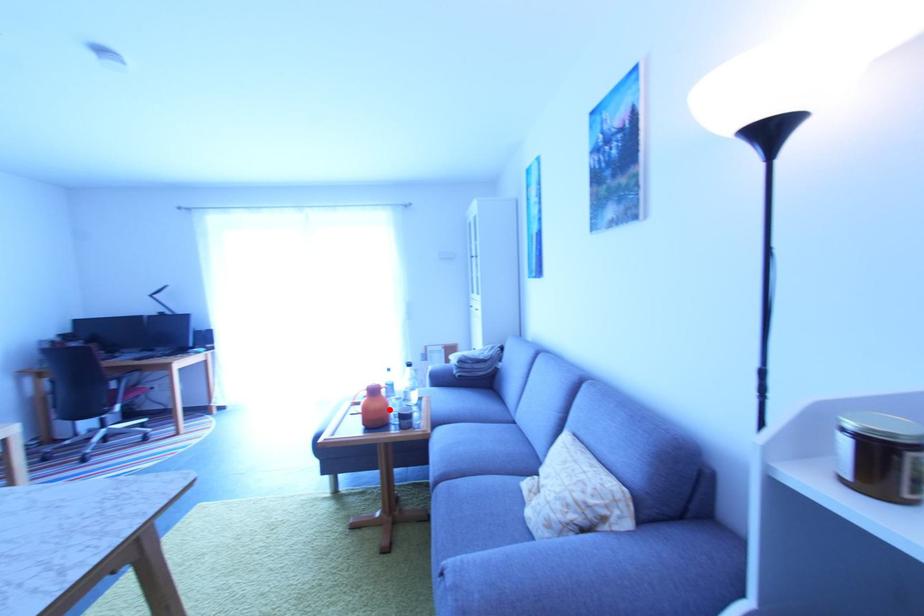
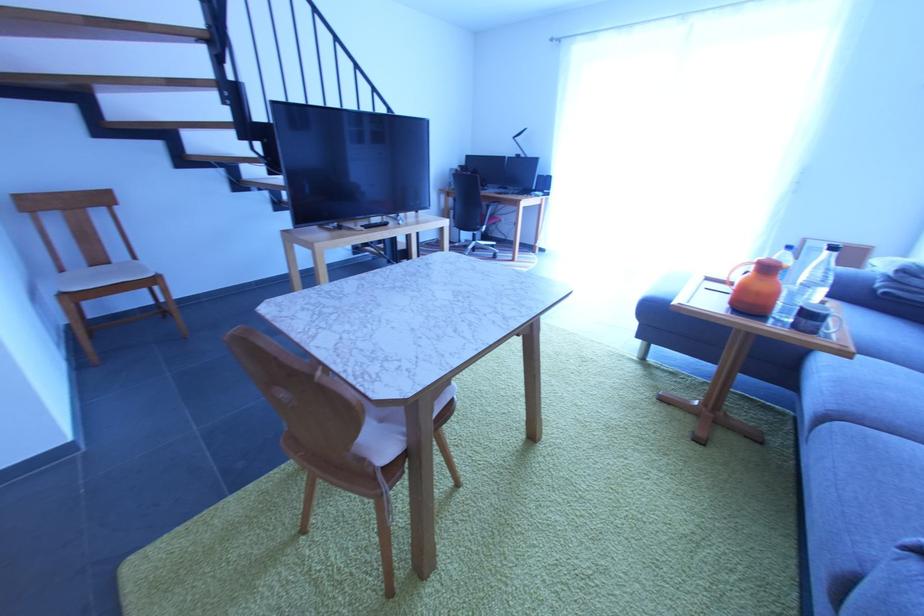
Find the pixel in the second image that matches the highlighted location in the first image.

(779, 297)